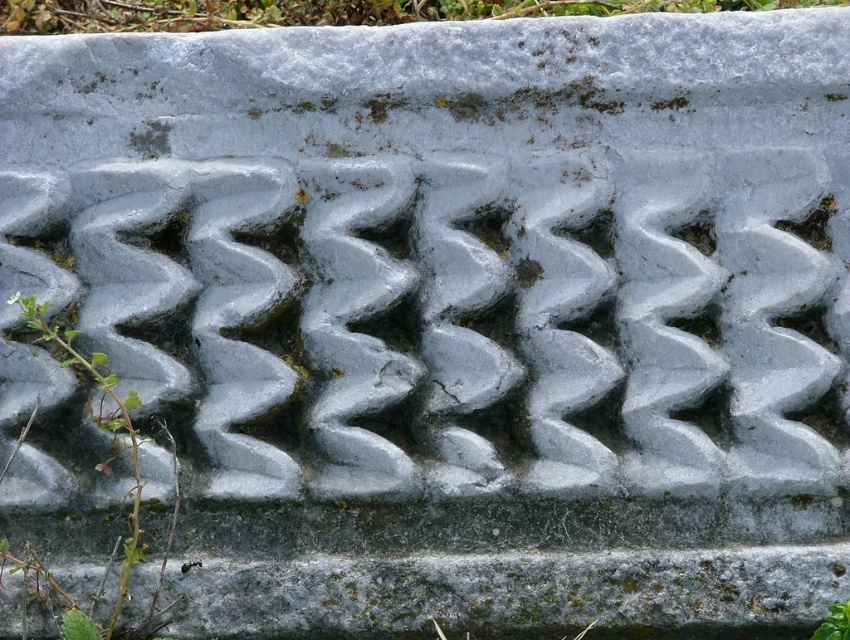
Question: Does green grass at upper center appear on the left side of green leafy weed at left?

Choices:
 (A) no
 (B) yes

Answer: (A)

Question: Among these objects, which one is farthest from the camera?

Choices:
 (A) green leafy weed at left
 (B) green grass at upper center

Answer: (B)

Question: Which of the following is the farthest from the observer?

Choices:
 (A) green grass at upper center
 (B) green leafy weed at left

Answer: (A)

Question: Observing the image, what is the correct spatial positioning of green grass at upper center in reference to green leafy weed at left?

Choices:
 (A) below
 (B) above

Answer: (B)

Question: Considering the relative positions of green grass at upper center and green leafy weed at left in the image provided, where is green grass at upper center located with respect to green leafy weed at left?

Choices:
 (A) above
 (B) below

Answer: (A)